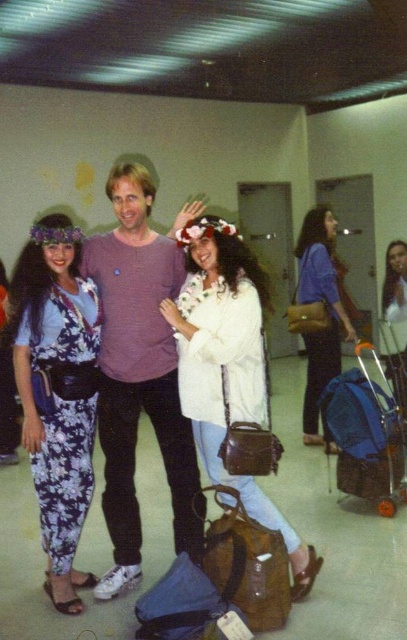
Is point (194, 428) less distant than point (372, 349)?

Yes.

Is white matte sweater at center closer to camera compared to blue fabric suitcase at lower right?

Yes, white matte sweater at center is closer to the viewer.

I want to click on white matte sweater at center, so click(227, 365).

Which is more to the right, purple cotton shirt at center or floral print jumpsuit at left?

purple cotton shirt at center is more to the right.

How much distance is there between purple cotton shirt at center and floral print jumpsuit at left?

A distance of 8.99 inches exists between purple cotton shirt at center and floral print jumpsuit at left.

Measure the distance between purple cotton shirt at center and camera.

purple cotton shirt at center is 8.65 feet from camera.

Where is `purple cotton shirt at center`? Image resolution: width=407 pixels, height=640 pixels. purple cotton shirt at center is located at coordinates (139, 369).

Which is more to the left, purple cotton shirt at center or blue fabric suitcase at lower right?

From the viewer's perspective, purple cotton shirt at center appears more on the left side.

Between point (122, 566) and point (354, 388), which one is positioned in front?

Point (122, 566) is in front.

Is point (127, 412) more distant than point (365, 403)?

No.

This screenshot has height=640, width=407. Identify the location of purple cotton shirt at center. (139, 369).